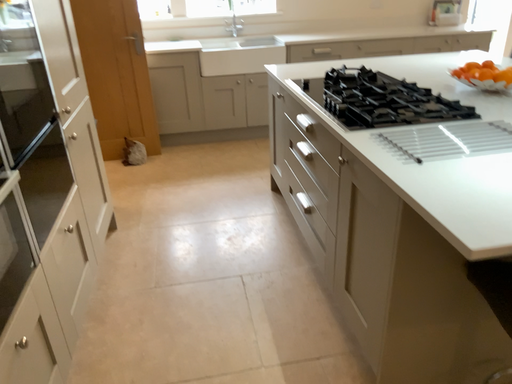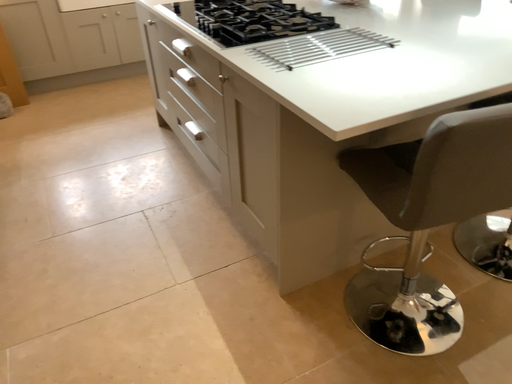
Question: Which way did the camera rotate in the video?

Choices:
 (A) rotated downward
 (B) rotated upward

Answer: (A)